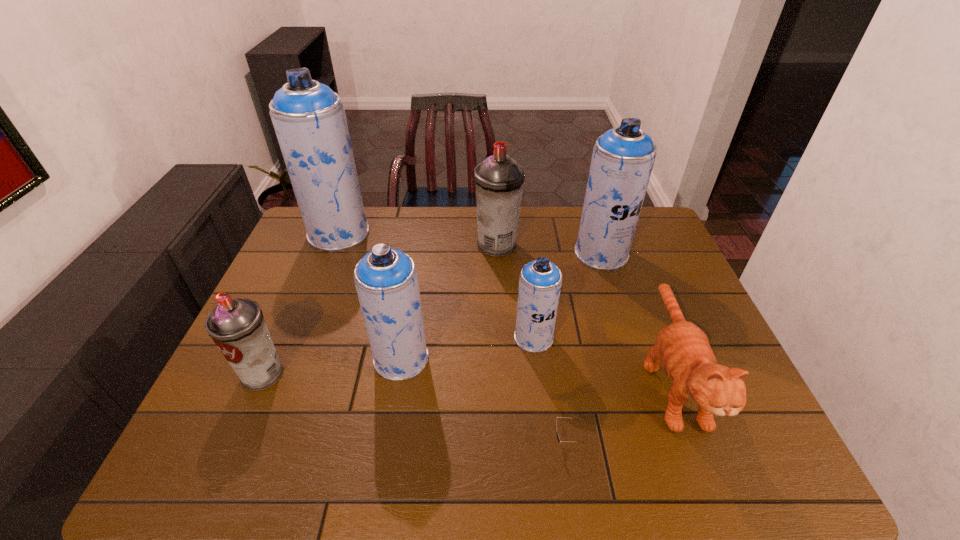
Find the location of a particular element. The image size is (960, 540). object that is at the near right corner is located at coordinates [x=683, y=349].

This screenshot has width=960, height=540. Identify the location of free space at the far edge. (376, 241).

You are a GUI agent. You are given a task and a screenshot of the screen. Output one action in this format:
    pyautogui.click(x=<x>, y=<y>)
    Task: Click on the vacant space at the near edge of the desktop
    This screenshot has width=960, height=540.
    Given the screenshot: What is the action you would take?
    pyautogui.click(x=392, y=446)

Identify the location of vacant area at the left edge of the desktop. The height and width of the screenshot is (540, 960). (290, 313).

In the image, there is a desktop. Where is `vacant space at the right edge`? This screenshot has height=540, width=960. vacant space at the right edge is located at coordinates (636, 279).

At what (x,y) coordinates should I click in order to perform the action: click on vacant space at the far right corner of the desktop. Please return your answer as a coordinate pair (x, y). The image size is (960, 540). Looking at the image, I should click on (660, 227).

At what (x,y) coordinates should I click in order to perform the action: click on free space between the black sunglasses and the second tallest aerosol can. Please return your answer as a coordinate pair (x, y). The image size is (960, 540). Looking at the image, I should click on (584, 347).

I want to click on unoccupied position between the rightmost aerosol can and the tallest object, so click(470, 243).

You are a GUI agent. You are given a task and a screenshot of the screen. Output one action in this format:
    pyautogui.click(x=<x>, y=<y>)
    Task: Click on the free space between the second smallest blue aerosol can and the right gray aerosol can
    This screenshot has height=540, width=960.
    Given the screenshot: What is the action you would take?
    pyautogui.click(x=449, y=302)

Identify the location of vacant space that is in between the tallest aerosol can and the third smallest blue aerosol can. (470, 243).